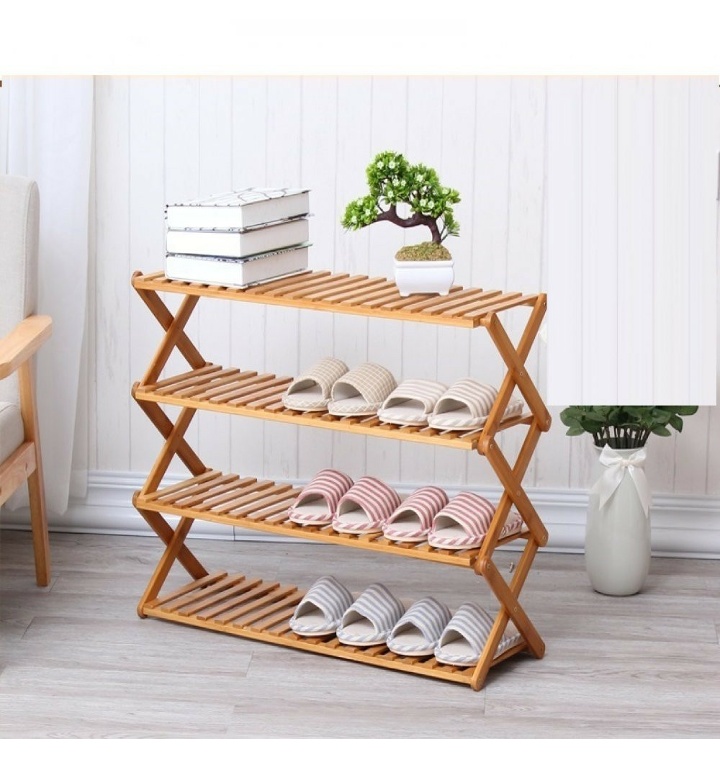
At what (x,y) coordinates should I click in order to perform the action: click on wooden support beams. Please return your answer as a coordinate pair (x, y). This screenshot has height=758, width=720. Looking at the image, I should click on (186, 343), (176, 333), (515, 359), (526, 337), (523, 503), (526, 456), (163, 421), (176, 436), (165, 533), (162, 571).